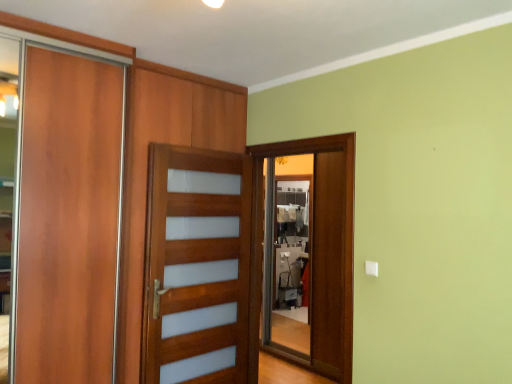
Question: Is point (183, 319) positioned closer to the camera than point (311, 337)?

Choices:
 (A) closer
 (B) farther

Answer: (A)

Question: Considering the positions of translucent wood screen door at center, the 2th screen door in the right-to-left sequence, and wooden screen door at center, the second screen door positioned from the left, in the image, is translucent wood screen door at center, the 2th screen door in the right-to-left sequence, bigger or smaller than wooden screen door at center, the second screen door positioned from the left,?

Choices:
 (A) small
 (B) big

Answer: (B)

Question: Would you say translucent wood screen door at center, the first screen door positioned from the left, is to the left or to the right of wooden screen door at center, which is counted as the 1th screen door, starting from the right, in the picture?

Choices:
 (A) left
 (B) right

Answer: (A)

Question: Is wooden screen door at center, which is counted as the 1th screen door, starting from the right, in front of or behind translucent wood screen door at center, the first screen door positioned from the left, in the image?

Choices:
 (A) behind
 (B) front

Answer: (A)

Question: Considering the positions of wooden screen door at center, which is counted as the 1th screen door, starting from the right, and translucent wood screen door at center, the first screen door positioned from the left, in the image, is wooden screen door at center, which is counted as the 1th screen door, starting from the right, taller or shorter than translucent wood screen door at center, the first screen door positioned from the left,?

Choices:
 (A) short
 (B) tall

Answer: (B)

Question: From the image's perspective, relative to translucent wood screen door at center, the first screen door positioned from the left, is wooden screen door at center, the second screen door positioned from the left, above or below?

Choices:
 (A) below
 (B) above

Answer: (B)

Question: Would you say wooden screen door at center, which is counted as the 1th screen door, starting from the right, is to the left or to the right of translucent wood screen door at center, the first screen door positioned from the left, in the picture?

Choices:
 (A) right
 (B) left

Answer: (A)